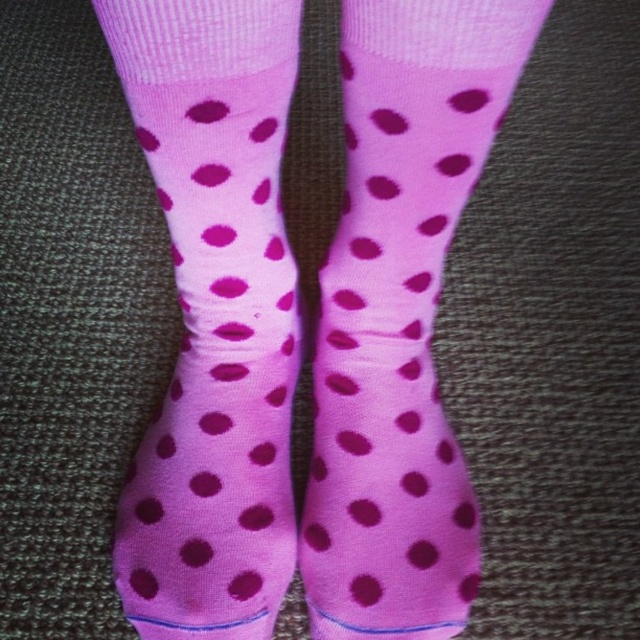
You are designing a shoe display and need to place the pink dotted sock at center and the pink matte socks at center on a shelf. The shelf has a width of 12 centimeters. Can both items fit side by side without overlapping?

The pink dotted sock at center is 12.68 centimeters away from pink matte socks at center, meaning there is insufficient space on a 12 cm shelf for both items to fit side by side without overlapping.

In the scene shown: You are standing in a room with two points marked on the floor. The first point is at coordinates point(294, 10) and the second is at point(358, 420). If you face the direction where the two feet wearing pink socks with dark pink polka dots are pointing, which point is closer to you?

Point(294, 10) is in front of point(358, 420), so it is closer to you when facing the direction of the feet.

You are trying to pair your socks for the day and notice two pairs in your drawer labeled as the pink dotted sock at center and pink matte socks at center. If you want to wear the pair that covers more of your leg, which one should you choose?

The pink dotted sock at center has a larger size compared to pink matte socks at center, so you should choose the pink dotted sock at center as it covers more of your leg.